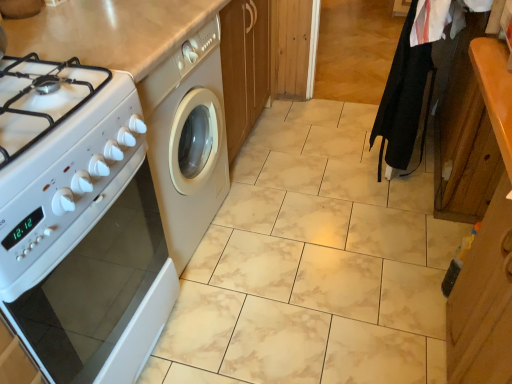
Describe the element at coordinates (404, 100) in the screenshot. I see `black fabric robe at right` at that location.

Describe the element at coordinates (487, 248) in the screenshot. I see `wooden cabinet at right` at that location.

Measure the distance between wooden cabinet at right and camera.

wooden cabinet at right and camera are 31.42 inches apart from each other.

Measure the distance between point (82, 339) and camera.

The distance of point (82, 339) from camera is 3.38 feet.

I want to click on black fabric robe at right, so click(x=404, y=100).

From a real-world perspective, relative to white glossy oven at left, is wooden cabinet at right vertically above or below?

wooden cabinet at right is above white glossy oven at left.

Which is in front, point (463, 305) or point (95, 354)?

The point (95, 354) is closer.

In the image, is wooden cabinet at right on the left side or the right side of black fabric robe at right?

From the image, it's evident that wooden cabinet at right is to the left of black fabric robe at right.

Is wooden cabinet at right wider than black fabric robe at right?

Yes, wooden cabinet at right is wider than black fabric robe at right.

Is point (481, 236) farther from viewer compared to point (418, 65)?

No, (481, 236) is in front of (418, 65).

Can black fabric robe at right be found inside wooden cabinet at right?

Actually, black fabric robe at right is outside wooden cabinet at right.

Which object is closer to the camera taking this photo, black fabric robe at right or wooden cabinet at right?

Positioned in front is wooden cabinet at right.

Is black fabric robe at right positioned with its back to wooden cabinet at right?

No, black fabric robe at right is not facing the opposite direction of wooden cabinet at right.

From the image's perspective, is black fabric robe at right positioned above or below wooden cabinet at right?

black fabric robe at right is situated higher than wooden cabinet at right in the image.

Is black fabric robe at right thinner than wooden cabinet at right?

Indeed, black fabric robe at right has a lesser width compared to wooden cabinet at right.

Is white glossy oven at left not within wooden cabinet at right?

Yes, white glossy oven at left is located beyond the bounds of wooden cabinet at right.

Between white glossy oven at left and wooden cabinet at right, which one has more height?

wooden cabinet at right.

Is white glossy oven at left beside wooden cabinet at right?

There is a gap between white glossy oven at left and wooden cabinet at right.

Is black fabric robe at right wider than white glossy oven at left?

In fact, black fabric robe at right might be narrower than white glossy oven at left.

Is black fabric robe at right shorter than white glossy oven at left?

No.

Between black fabric robe at right and white glossy oven at left, which one has larger size?

white glossy oven at left.

Can you confirm if white glossy oven at left is shorter than black fabric robe at right?

Indeed, white glossy oven at left has a lesser height compared to black fabric robe at right.

Based on the photo, between white glossy oven at left and black fabric robe at right, which one has smaller size?

black fabric robe at right is smaller.

In the scene shown: Does white glossy oven at left turn towards black fabric robe at right?

No, white glossy oven at left is not aimed at black fabric robe at right.

From a real-world perspective, is white glossy oven at left under black fabric robe at right?

Yes, from a real-world perspective, white glossy oven at left is under black fabric robe at right.

The width and height of the screenshot is (512, 384). I want to click on oven located on the left of wooden cabinet at right, so click(x=95, y=287).

Locate an element on the screen. cabinetry that appears in front of the black fabric robe at right is located at coordinates (487, 248).

Looking at the image, which one is located closer to black fabric robe at right, white glossy oven at left or wooden cabinet at right?

wooden cabinet at right is positioned closer to the anchor black fabric robe at right.

Looking at the image, which one is located further to wooden cabinet at right, black fabric robe at right or white glossy oven at left?

white glossy oven at left is positioned further to the anchor wooden cabinet at right.

Based on their spatial positions, is wooden cabinet at right or black fabric robe at right closer to white glossy oven at left?

wooden cabinet at right lies closer to white glossy oven at left than the other object.

From the image, which object appears to be nearer to black fabric robe at right, wooden cabinet at right or white glossy oven at left?

wooden cabinet at right.

Considering their positions, is white glossy oven at left positioned closer to wooden cabinet at right than black fabric robe at right?

Based on the image, black fabric robe at right appears to be nearer to wooden cabinet at right.

When comparing their distances from white glossy oven at left, does black fabric robe at right or wooden cabinet at right seem closer?

Among the two, wooden cabinet at right is located nearer to white glossy oven at left.

Find the location of `cabinetry located between white glossy oven at left and black fabric robe at right in the left-right direction`. cabinetry located between white glossy oven at left and black fabric robe at right in the left-right direction is located at coordinates (487, 248).